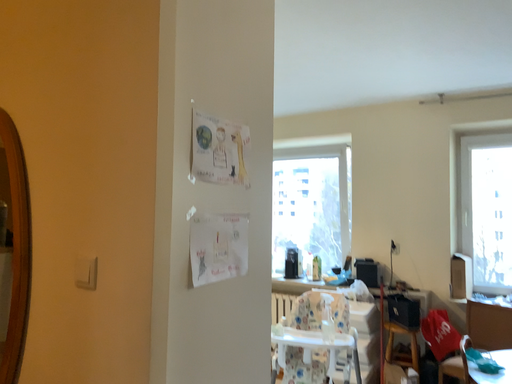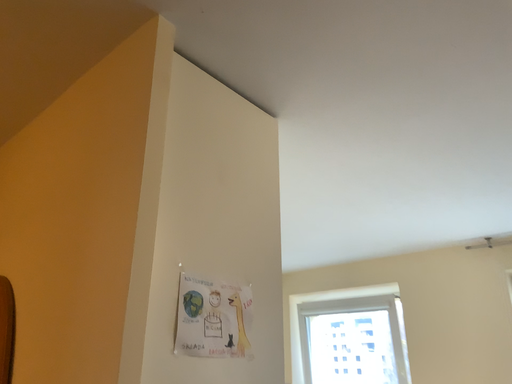
Question: How did the camera likely rotate when shooting the video?

Choices:
 (A) rotated downward
 (B) rotated upward

Answer: (B)